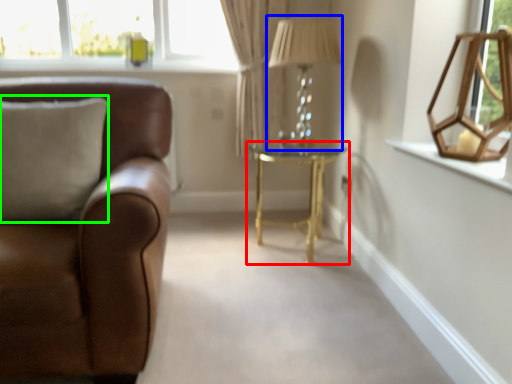
Question: Which object is positioned closest to table (highlighted by a red box)? Select from table lamp (highlighted by a blue box) and pillow (highlighted by a green box).

Choices:
 (A) table lamp
 (B) pillow

Answer: (A)